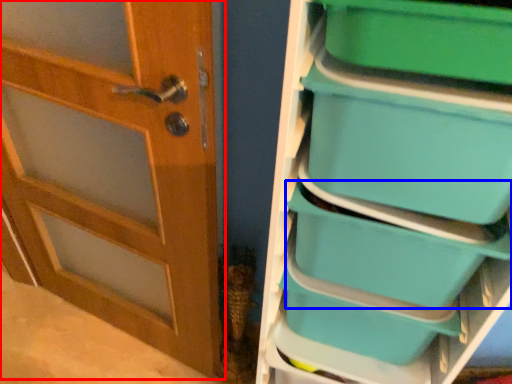
Question: Which point is further to the camera, door (highlighted by a red box) or storage box (highlighted by a blue box)?

Choices:
 (A) door
 (B) storage box

Answer: (B)